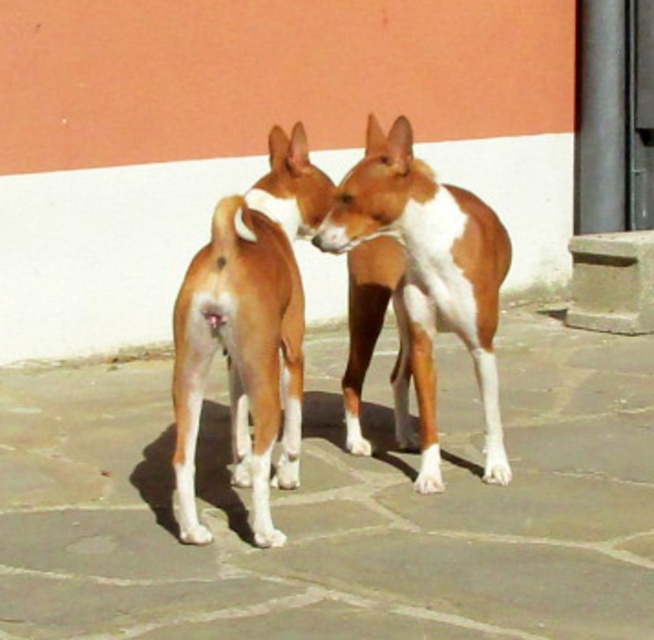
Is brown stone pavement at center below brown smooth dog at center?

Yes.

Is brown stone pavement at center to the left of brown smooth dog at center from the viewer's perspective?

Yes, brown stone pavement at center is to the left of brown smooth dog at center.

Does point (315, 477) come behind point (502, 440)?

Yes, point (315, 477) is behind point (502, 440).

The width and height of the screenshot is (654, 640). Find the location of `brown stone pavement at center`. brown stone pavement at center is located at coordinates (337, 504).

Who is positioned more to the left, brown/white fur dog at center or brown smooth dog at center?

From the viewer's perspective, brown/white fur dog at center appears more on the left side.

Measure the distance from brown/white fur dog at center to brown smooth dog at center.

27.57 inches

This screenshot has width=654, height=640. I want to click on brown/white fur dog at center, so click(249, 332).

I want to click on brown/white fur dog at center, so click(x=249, y=332).

Which of these two, brown stone pavement at center or brown/white fur dog at center, stands shorter?

brown stone pavement at center

Does brown stone pavement at center have a lesser width compared to brown/white fur dog at center?

In fact, brown stone pavement at center might be wider than brown/white fur dog at center.

This screenshot has height=640, width=654. In order to click on brown stone pavement at center in this screenshot , I will do `click(337, 504)`.